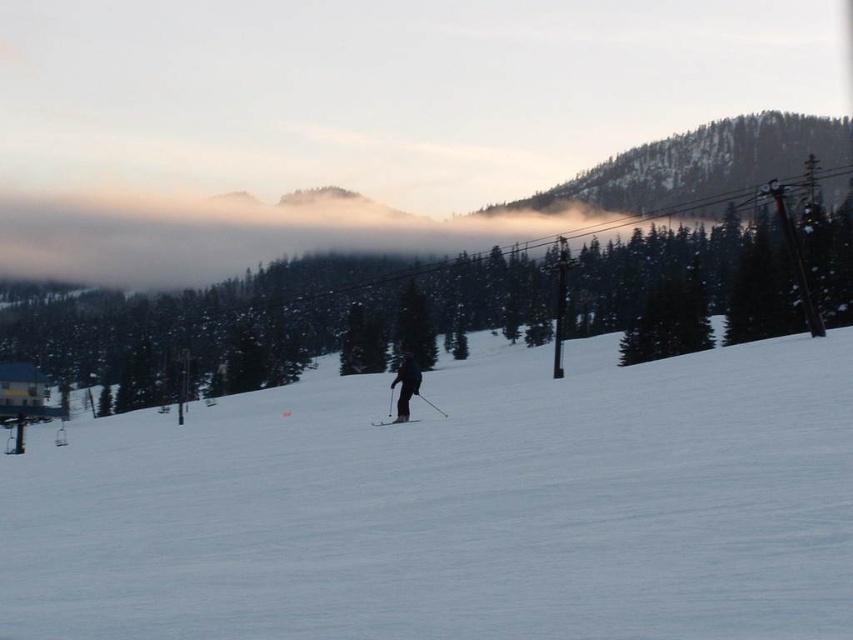
You are a photographer planning to take a photo of the white snow ski slope at center and the matte black ski at center. Which object will appear larger in the photo?

The white snow ski slope at center will appear larger in the photo because it is closer to the camera than the matte black ski at center.

You are a photographer trying to capture the skier in the scene. If you want to ensure both the dark blue ski suit at center and the matte black ski at center are fully visible in your shot, which object should you focus on to frame the wider part?

The matte black ski at center has a greater width, so focusing on it would ensure the wider part is framed, allowing both the dark blue ski suit at center and the matte black ski at center to be fully visible.

You are standing at the camera position and want to reach the point marked as point (x=413, y=381). If you walk straight towards it, how far will you have to walk?

You will have to walk 183.67 feet to reach point (x=413, y=381) from the camera position.